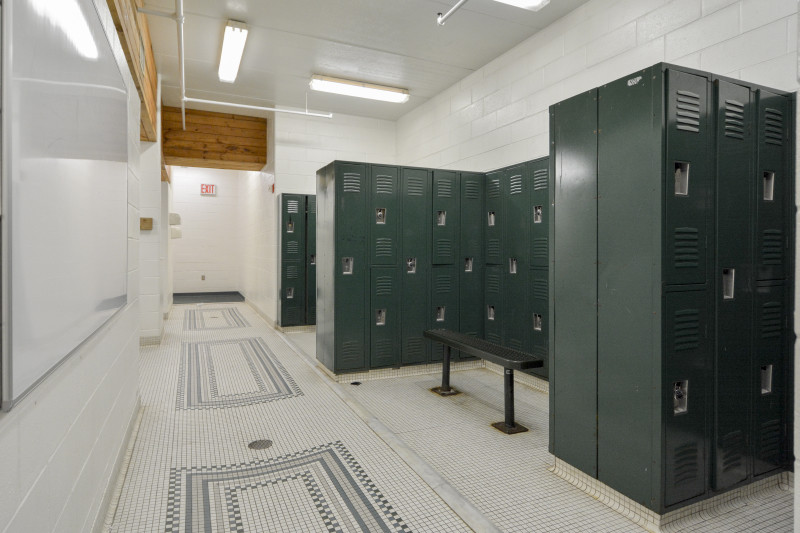
Find the location of a particular element. This screenshot has width=800, height=533. wall is located at coordinates (94, 378), (508, 109), (340, 138).